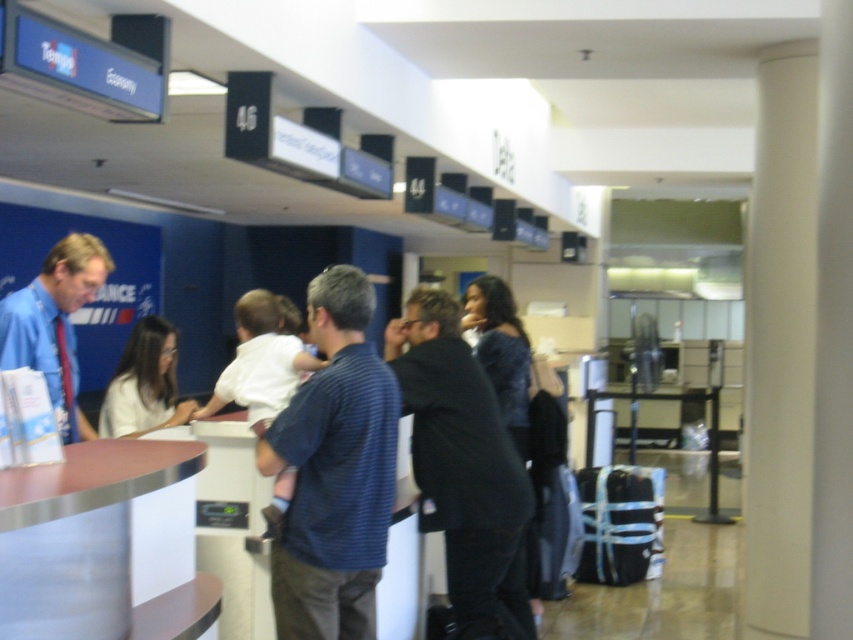
Between black matte jacket at center and white shirt at center, which one appears on the right side from the viewer's perspective?

black matte jacket at center

Consider the image. Who is shorter, black matte jacket at center or white shirt at center?

Standing shorter between the two is white shirt at center.

Is point (471, 522) closer to camera compared to point (177, 337)?

Yes.

At what (x,y) coordinates should I click in order to perform the action: click on black matte jacket at center. Please return your answer as a coordinate pair (x, y). This screenshot has width=853, height=640. Looking at the image, I should click on (463, 467).

How distant is blue striped shirt at center from white shirt at center?

blue striped shirt at center is 4.62 feet away from white shirt at center.

Does blue striped shirt at center have a lesser height compared to white shirt at center?

No, blue striped shirt at center is not shorter than white shirt at center.

Locate an element on the screen. blue striped shirt at center is located at coordinates (334, 470).

At what (x,y) coordinates should I click in order to perform the action: click on blue striped shirt at center. Please return your answer as a coordinate pair (x, y). Looking at the image, I should click on (334, 470).

In the scene shown: Between blue striped shirt at center and blue shirt at left, which one is positioned higher?

blue shirt at left

Which is behind, point (381, 390) or point (83, 291)?

The point (83, 291) is behind.

In the scene shown: Who is more distant from viewer, (329, 285) or (53, 316)?

Positioned behind is point (53, 316).

Where is `blue striped shirt at center`? The height and width of the screenshot is (640, 853). blue striped shirt at center is located at coordinates [334, 470].